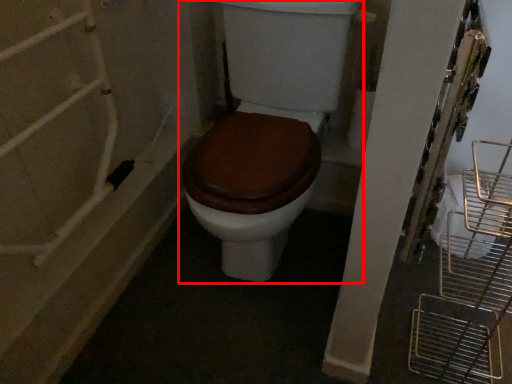
Question: Considering the relative positions of toilet (annotated by the red box) and bath in the image provided, where is toilet (annotated by the red box) located with respect to the staircase?

Choices:
 (A) left
 (B) right

Answer: (B)